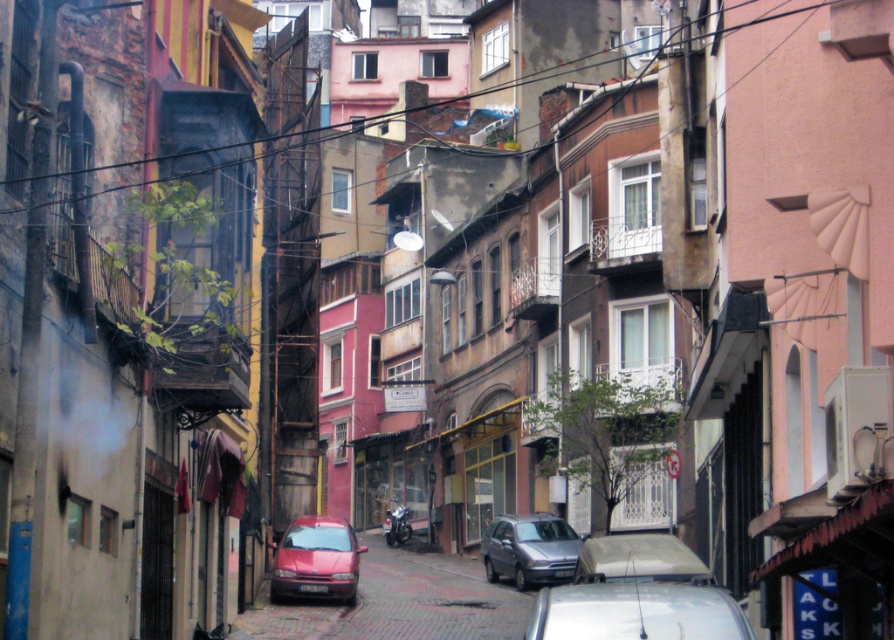
From the picture: Can you confirm if metallic red car at center is taller than metallic silver car at center?

In fact, metallic red car at center may be shorter than metallic silver car at center.

Can you confirm if metallic red car at center is positioned above metallic silver car at center?

Incorrect, metallic red car at center is not positioned above metallic silver car at center.

At what (x,y) coordinates should I click in order to perform the action: click on metallic red car at center. Please return your answer as a coordinate pair (x, y). Looking at the image, I should click on (399, 602).

Between point (351, 563) and point (530, 561), which one is positioned behind?

The point (530, 561) is behind.

Locate an element on the screen. The height and width of the screenshot is (640, 894). shiny red car at center is located at coordinates (316, 560).

Can you confirm if silver metallic hatchback at center is positioned above metallic silver car at center?

No.

Locate an element on the screen. The height and width of the screenshot is (640, 894). silver metallic hatchback at center is located at coordinates (529, 548).